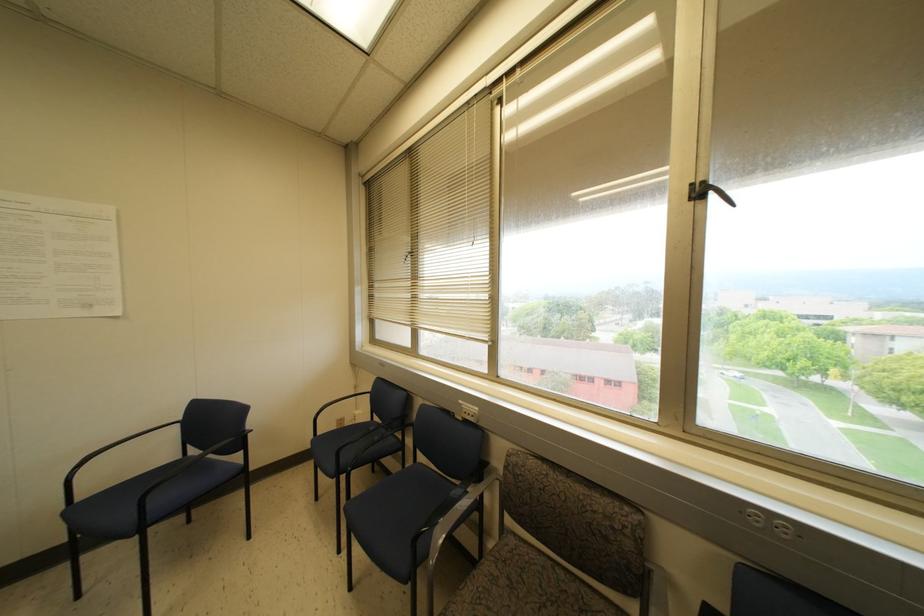
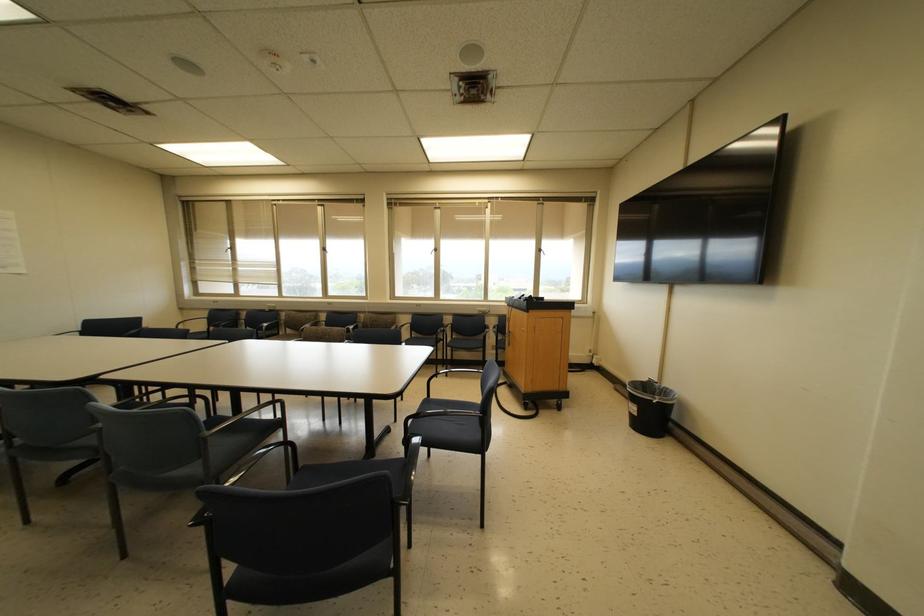
In the second image, find the point that corresponds to [733,205] in the first image.

(327, 253)